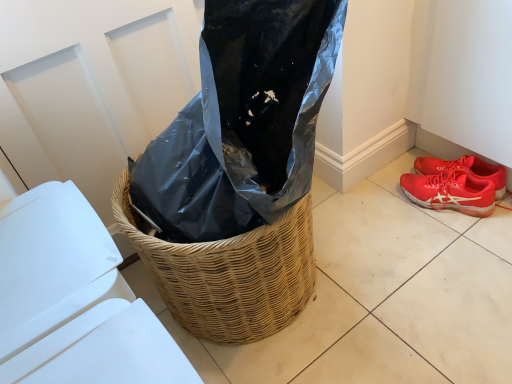
This screenshot has width=512, height=384. I want to click on vacant space underneath shiny red sneakers at lower right, which is the first footwear in bottom-to-top order (from a real-world perspective), so click(450, 214).